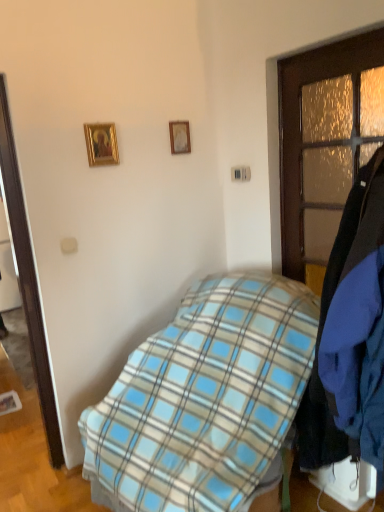
At what (x,y) coordinates should I click in order to perform the action: click on blue plaid blanket at center. Please return your answer as a coordinate pair (x, y). This screenshot has width=384, height=512. Looking at the image, I should click on (205, 398).

This screenshot has width=384, height=512. Find the location of `gold-framed picture at upper left, the first picture frame viewed from the front`. gold-framed picture at upper left, the first picture frame viewed from the front is located at coordinates tap(101, 144).

The image size is (384, 512). In order to click on wooden door at right in this screenshot , I will do `click(325, 140)`.

I want to click on wooden picture frame at upper center, which is the second picture frame from front to back, so click(x=179, y=137).

Is point (101, 135) more distant than point (204, 362)?

Yes, it is behind point (204, 362).

From the image's perspective, between gold-framed picture at upper left, arranged as the 2th picture frame when viewed from the right, and blue plaid blanket at center, which one is located above?

From the image's view, gold-framed picture at upper left, arranged as the 2th picture frame when viewed from the right, is above.

Which object is closer to the camera, gold-framed picture at upper left, the 2th picture frame in the back-to-front sequence, or blue plaid blanket at center?

blue plaid blanket at center is closer to the camera.

Is wooden picture frame at upper center, which is the second picture frame from front to back, positioned far away from blue plaid blanket at center?

Yes, wooden picture frame at upper center, which is the second picture frame from front to back, and blue plaid blanket at center are quite far apart.

Does point (184, 150) lie in front of point (241, 431)?

No, (184, 150) is further to viewer.

Consider the image. Can you confirm if wooden picture frame at upper center, which is the second picture frame from front to back, is thinner than blue plaid blanket at center?

Indeed, wooden picture frame at upper center, which is the second picture frame from front to back, has a lesser width compared to blue plaid blanket at center.

Could you tell me if wooden picture frame at upper center, the 1th picture frame in the back-to-front sequence, is facing blue plaid blanket at center?

No, wooden picture frame at upper center, the 1th picture frame in the back-to-front sequence, does not turn towards blue plaid blanket at center.

This screenshot has width=384, height=512. What are the coordinates of `the 1st picture frame positioned above the blue plaid blanket at center (from the image's perspective)` in the screenshot? It's located at (101, 144).

Is point (223, 474) farther from viewer compared to point (96, 131)?

That is False.

Which object is positioned more to the left, blue plaid blanket at center or gold-framed picture at upper left, the first picture frame when ordered from left to right?

From the viewer's perspective, gold-framed picture at upper left, the first picture frame when ordered from left to right, appears more on the left side.

Is blue plaid blanket at center positioned beyond the bounds of gold-framed picture at upper left, arranged as the 2th picture frame when viewed from the right?

Yes, blue plaid blanket at center is located beyond the bounds of gold-framed picture at upper left, arranged as the 2th picture frame when viewed from the right.

Between gold-framed picture at upper left, the first picture frame viewed from the front, and wooden picture frame at upper center, the 2th picture frame from the left, which one has larger width?

gold-framed picture at upper left, the first picture frame viewed from the front, is wider.

Does gold-framed picture at upper left, the 2th picture frame in the back-to-front sequence, turn towards wooden picture frame at upper center, the 2th picture frame from the left?

No, gold-framed picture at upper left, the 2th picture frame in the back-to-front sequence, is not oriented towards wooden picture frame at upper center, the 2th picture frame from the left.

Are gold-framed picture at upper left, the first picture frame when ordered from left to right, and wooden picture frame at upper center, the 2th picture frame from the left, beside each other?

No, gold-framed picture at upper left, the first picture frame when ordered from left to right, is not with wooden picture frame at upper center, the 2th picture frame from the left.

Between gold-framed picture at upper left, the first picture frame when ordered from left to right, and wooden picture frame at upper center, the 1th picture frame in the back-to-front sequence, which one has less height?

wooden picture frame at upper center, the 1th picture frame in the back-to-front sequence, is shorter.

Does wooden door at right have a lesser width compared to blue plaid blanket at center?

Indeed, wooden door at right has a lesser width compared to blue plaid blanket at center.

Are wooden door at right and blue plaid blanket at center located far from each other?

No, wooden door at right is not far away from blue plaid blanket at center.

From a real-world perspective, between wooden door at right and blue plaid blanket at center, who is vertically higher?

wooden door at right is physically above.

Does wooden door at right turn towards wooden picture frame at upper center, which is the second picture frame from front to back?

No, wooden door at right does not turn towards wooden picture frame at upper center, which is the second picture frame from front to back.

Which is behind, wooden door at right or wooden picture frame at upper center, the 1th picture frame in the right-to-left sequence?

wooden picture frame at upper center, the 1th picture frame in the right-to-left sequence.

From a real-world perspective, does wooden door at right stand above wooden picture frame at upper center, the 2th picture frame from the left?

No, from a real-world perspective, wooden door at right is not on top of wooden picture frame at upper center, the 2th picture frame from the left.

From a real-world perspective, count 2nd picture frames upward from the wooden door at right and point to it. Please provide its 2D coordinates.

[(179, 137)]

Locate an element on the screen. Image resolution: width=384 pixels, height=512 pixels. picture frame on the right of gold-framed picture at upper left, the first picture frame viewed from the front is located at coordinates (179, 137).

Who is taller, wooden picture frame at upper center, the 1th picture frame in the right-to-left sequence, or gold-framed picture at upper left, the first picture frame viewed from the front?

gold-framed picture at upper left, the first picture frame viewed from the front.

Does wooden picture frame at upper center, the 1th picture frame in the back-to-front sequence, appear on the left side of gold-framed picture at upper left, the first picture frame viewed from the front?

No.

Is point (179, 133) positioned after point (93, 144)?

Yes, it is behind point (93, 144).

This screenshot has width=384, height=512. In order to click on the 2nd picture frame to the left of the blue plaid blanket at center, counting from the anchor's position in this screenshot , I will do `click(101, 144)`.

The image size is (384, 512). In order to click on picture frame that is the 2nd one above the blue plaid blanket at center (from a real-world perspective) in this screenshot , I will do `click(179, 137)`.

Estimate the real-world distances between objects in this image. Which object is closer to blue plaid blanket at center, wooden picture frame at upper center, the 2th picture frame from the left, or wooden door at right?

The object closer to blue plaid blanket at center is wooden door at right.

Looking at the image, which one is located further to gold-framed picture at upper left, the 2th picture frame in the back-to-front sequence, blue plaid blanket at center or wooden picture frame at upper center, the 1th picture frame in the right-to-left sequence?

blue plaid blanket at center is further to gold-framed picture at upper left, the 2th picture frame in the back-to-front sequence.

When comparing their distances from wooden picture frame at upper center, the 1th picture frame in the back-to-front sequence, does wooden door at right or blue plaid blanket at center seem closer?

wooden door at right lies closer to wooden picture frame at upper center, the 1th picture frame in the back-to-front sequence, than the other object.

Which object lies further to the anchor point wooden picture frame at upper center, which is the second picture frame from front to back, gold-framed picture at upper left, the first picture frame when ordered from left to right, or wooden door at right?

wooden door at right is positioned further to the anchor wooden picture frame at upper center, which is the second picture frame from front to back.

Looking at the image, which one is located further to gold-framed picture at upper left, the first picture frame when ordered from left to right, wooden door at right or blue plaid blanket at center?

blue plaid blanket at center is further to gold-framed picture at upper left, the first picture frame when ordered from left to right.

From the image, which object appears to be farther from blue plaid blanket at center, wooden door at right or gold-framed picture at upper left, arranged as the 2th picture frame when viewed from the right?

Among the two, gold-framed picture at upper left, arranged as the 2th picture frame when viewed from the right, is located further to blue plaid blanket at center.

From the image, which object appears to be farther from gold-framed picture at upper left, the first picture frame viewed from the front, wooden picture frame at upper center, the 1th picture frame in the back-to-front sequence, or wooden door at right?

wooden door at right.

When comparing their distances from wooden door at right, does wooden picture frame at upper center, the 1th picture frame in the back-to-front sequence, or gold-framed picture at upper left, the 2th picture frame in the back-to-front sequence, seem further?

The object further to wooden door at right is gold-framed picture at upper left, the 2th picture frame in the back-to-front sequence.

Find the location of `picture frame between gold-framed picture at upper left, arranged as the 2th picture frame when viewed from the right, and wooden door at right from left to right`. picture frame between gold-framed picture at upper left, arranged as the 2th picture frame when viewed from the right, and wooden door at right from left to right is located at coordinates (179, 137).

The image size is (384, 512). Identify the location of door between wooden picture frame at upper center, the 1th picture frame in the back-to-front sequence, and blue plaid blanket at center in the up-down direction. (325, 140).

Where is `picture frame between wooden picture frame at upper center, the 1th picture frame in the right-to-left sequence, and blue plaid blanket at center vertically`? The height and width of the screenshot is (512, 384). picture frame between wooden picture frame at upper center, the 1th picture frame in the right-to-left sequence, and blue plaid blanket at center vertically is located at coordinates (101, 144).

The height and width of the screenshot is (512, 384). I want to click on door between gold-framed picture at upper left, the first picture frame when ordered from left to right, and blue plaid blanket at center from top to bottom, so click(325, 140).